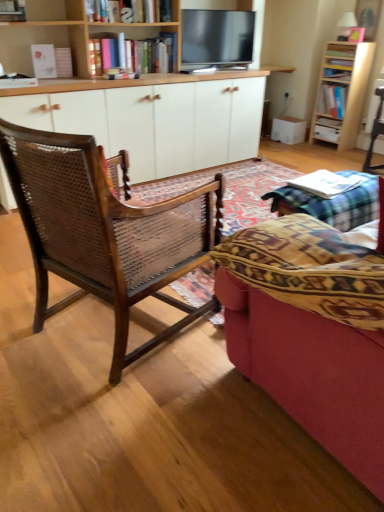
This screenshot has width=384, height=512. Identify the location of free location in front of wooden cane chair at left. (112, 426).